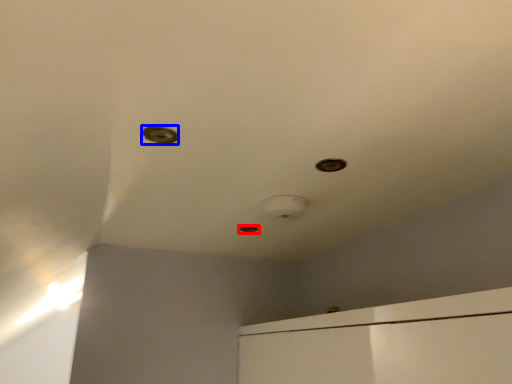
Question: Which point is further to the camera, hole (highlighted by a red box) or hole (highlighted by a blue box)?

Choices:
 (A) hole
 (B) hole

Answer: (A)